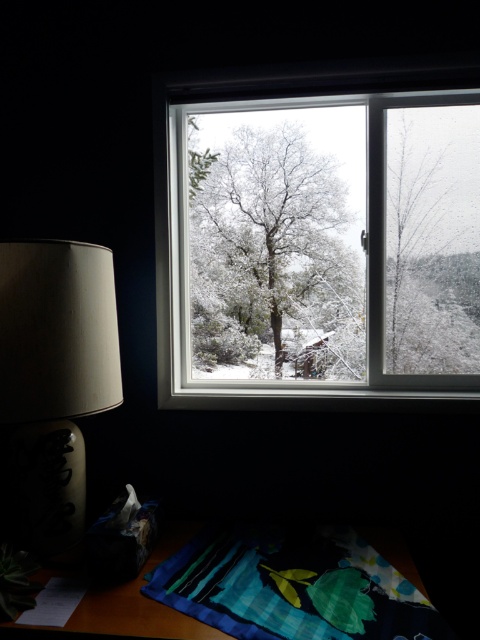
You are trying to decide whether to place a large painting on the wall next to the clear glass window at center and the matte beige lamp at left. Considering their sizes, which object should the painting be placed next to if you want it to match the scale of the object?

The clear glass window at center has a larger size compared to the matte beige lamp at left, so the painting should be placed next to the clear glass window at center to match its scale.